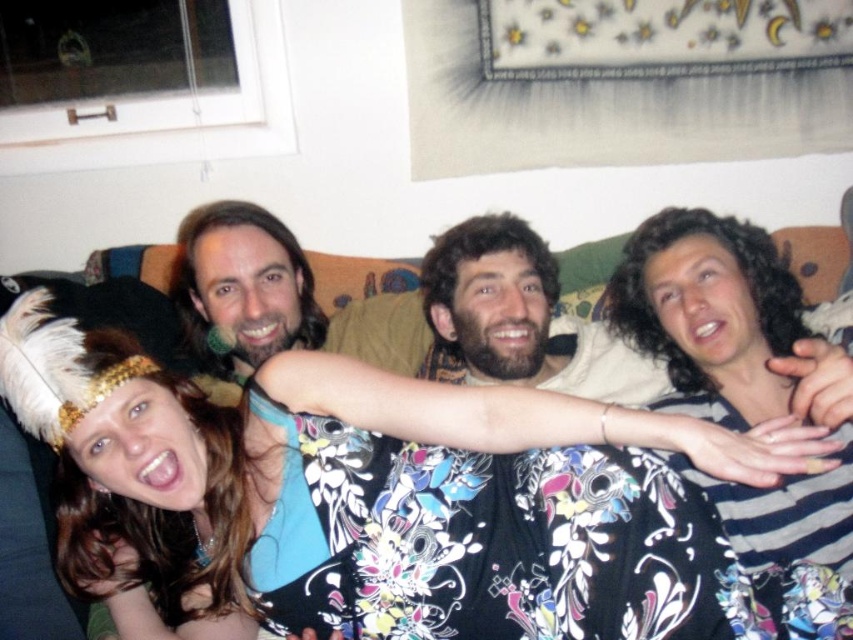
Question: Does floral dress at center have a greater width compared to brown curly hair at center?

Choices:
 (A) no
 (B) yes

Answer: (B)

Question: Which point is closer to the camera?

Choices:
 (A) (287, 312)
 (B) (561, 365)
 (C) (323, 637)

Answer: (C)

Question: Does striped cotton shirt at right appear on the right side of brown curly hair at center?

Choices:
 (A) no
 (B) yes

Answer: (B)

Question: Is striped cotton shirt at right thinner than shiny brown hair at center?

Choices:
 (A) yes
 (B) no

Answer: (A)

Question: Which point is farther to the camera?

Choices:
 (A) striped cotton shirt at right
 (B) floral dress at center

Answer: (A)

Question: Which point appears closest to the camera in this image?

Choices:
 (A) (270, 333)
 (B) (793, 305)

Answer: (B)